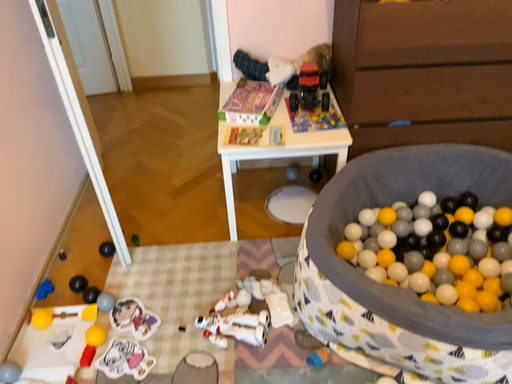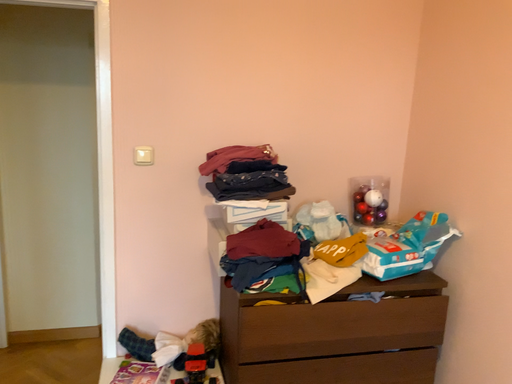
Question: Which way did the camera rotate in the video?

Choices:
 (A) rotated left
 (B) rotated right

Answer: (B)